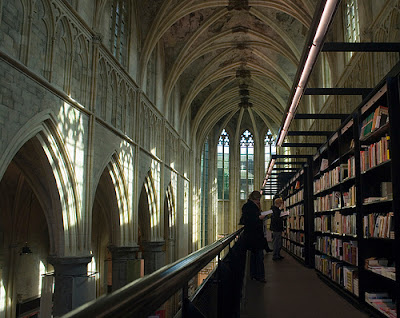
Find the location of a particular element. The image size is (400, 318). ceiling is located at coordinates (238, 20).